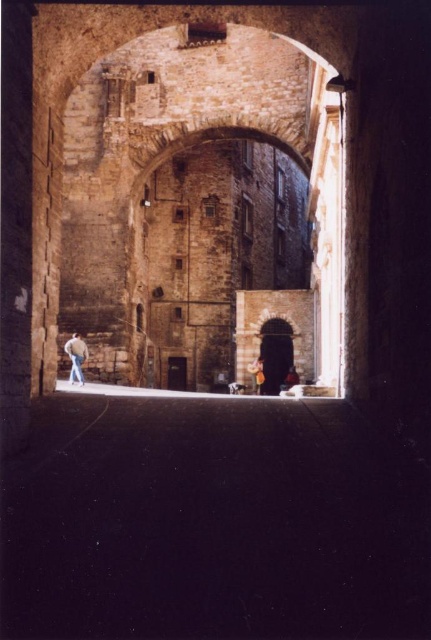
You are standing in front of the ancient stone archway and notice two points marked on the structure. The first point is at coordinates point (71, 422) and the second is at point (68, 380). Which of these two points is nearer to your current position?

Point (71, 422) is closer to the viewer than point (68, 380), so the first point is nearer to your current position.